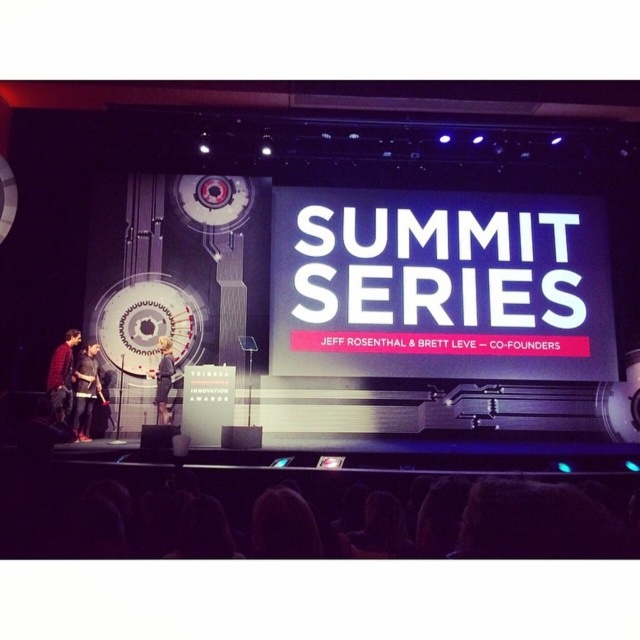
You are an event organizer who needs to adjust the placement of the jackets for better visibility. Since the matte black jacket at left is above the light brown leather jacket at center, which jacket should be moved to ensure both are visible to the audience?

The matte black jacket at left should be moved lower so that it does not block the view of the light brown leather jacket at center, ensuring both are visible to the audience.

Based on the photo, you are an event coordinator arranging seating for attendees. You notice two jackets on the stage, a dark gray fabric jacket at left and a light brown leather jacket at center. Which jacket is closer to the left side of the stage?

The dark gray fabric jacket at left is closer to the left side of the stage because it is positioned on the left side of the light brown leather jacket at center.

You are an event organizer who needs to ensure that the jackets displayed on the stage are arranged properly. Which of the two jackets, the dark gray fabric jacket at left or the matte black jacket at left, should be placed on the podium to the right to maintain balance in the stage setup?

The dark gray fabric jacket at left is smaller than the matte black jacket at left. To maintain balance, the smaller dark gray fabric jacket at left should be placed on the podium to the right, as it would complement the off center positioning without overwhelming the minimalist design.